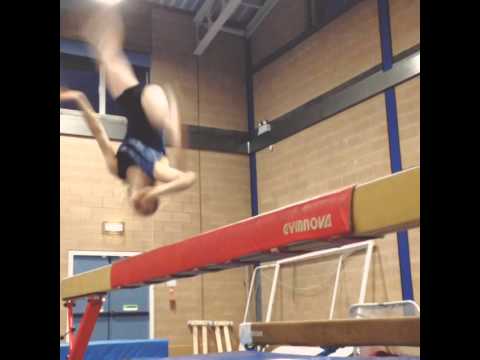
This screenshot has width=480, height=360. I want to click on door light, so click(x=118, y=227).